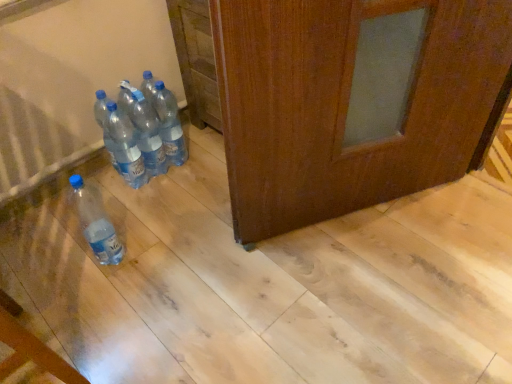
At what (x,y) coordinates should I click in order to perform the action: click on transparent plastic bottles at center, which ranks as the 3th bottle in left-to-right order. Please return your answer as a coordinate pair (x, y). The width and height of the screenshot is (512, 384). Looking at the image, I should click on (145, 130).

You are a GUI agent. You are given a task and a screenshot of the screen. Output one action in this format:
    pyautogui.click(x=<x>, y=<y>)
    Task: Click on the clear plastic bottles at center, the second bottle from the left
    
    Given the screenshot: What is the action you would take?
    pyautogui.click(x=124, y=146)

The height and width of the screenshot is (384, 512). Find the location of `transparent plastic bottles at center, acting as the 4th bottle starting from the left`. transparent plastic bottles at center, acting as the 4th bottle starting from the left is located at coordinates (169, 124).

In terms of size, does transparent plastic bottles at center, the first bottle viewed from the right, appear bigger or smaller than transparent plastic bottles at center, which ranks as the 3th bottle in left-to-right order?

Considering their sizes, transparent plastic bottles at center, the first bottle viewed from the right, takes up more space than transparent plastic bottles at center, which ranks as the 3th bottle in left-to-right order.

From a real-world perspective, is transparent plastic bottles at center, the first bottle viewed from the right, located beneath transparent plastic bottles at center, which ranks as the 3th bottle in left-to-right order?

Yes, from a real-world perspective, transparent plastic bottles at center, the first bottle viewed from the right, is under transparent plastic bottles at center, which ranks as the 3th bottle in left-to-right order.

Can you confirm if transparent plastic bottles at center, the first bottle viewed from the right, is taller than transparent plastic bottles at center, arranged as the 2th bottle when viewed from the right?

No, transparent plastic bottles at center, the first bottle viewed from the right, is not taller than transparent plastic bottles at center, arranged as the 2th bottle when viewed from the right.

Is transparent plastic bottles at center, the first bottle viewed from the right, oriented towards transparent plastic bottles at center, which ranks as the 3th bottle in left-to-right order?

No, transparent plastic bottles at center, the first bottle viewed from the right, is not facing towards transparent plastic bottles at center, which ranks as the 3th bottle in left-to-right order.

Between transparent plastic bottles at center, acting as the 4th bottle starting from the left, and clear plastic bottles at center, which is the 3th bottle in right-to-left order, which one has smaller width?

clear plastic bottles at center, which is the 3th bottle in right-to-left order.

From the image's perspective, relative to clear plastic bottles at center, the second bottle from the left, is transparent plastic bottles at center, the first bottle viewed from the right, above or below?

transparent plastic bottles at center, the first bottle viewed from the right, is situated higher than clear plastic bottles at center, the second bottle from the left, in the image.

Which object is positioned more to the right, transparent plastic bottles at center, acting as the 4th bottle starting from the left, or clear plastic bottles at center, the second bottle from the left?

transparent plastic bottles at center, acting as the 4th bottle starting from the left, is more to the right.

Is transparent plastic bottles at center, which ranks as the 3th bottle in left-to-right order, wider or thinner than matte plastic bottle at lower left, marked as the 1th bottle in a left-to-right arrangement?

In the image, transparent plastic bottles at center, which ranks as the 3th bottle in left-to-right order, appears to be more narrow than matte plastic bottle at lower left, marked as the 1th bottle in a left-to-right arrangement.

What's the angular difference between transparent plastic bottles at center, arranged as the 2th bottle when viewed from the right, and matte plastic bottle at lower left, which appears as the fourth bottle when viewed from the right,'s facing directions?

The angular difference between transparent plastic bottles at center, arranged as the 2th bottle when viewed from the right, and matte plastic bottle at lower left, which appears as the fourth bottle when viewed from the right, is 0.00195 degrees.

Considering the positions of point (145, 134) and point (79, 187), is point (145, 134) closer or farther from the camera than point (79, 187)?

Point (145, 134) is positioned farther from the camera compared to point (79, 187).

Can you confirm if matte plastic bottle at lower left, marked as the 1th bottle in a left-to-right arrangement, is taller than clear plastic bottles at center, which is the 3th bottle in right-to-left order?

Incorrect, the height of matte plastic bottle at lower left, marked as the 1th bottle in a left-to-right arrangement, is not larger of that of clear plastic bottles at center, which is the 3th bottle in right-to-left order.

From the image's perspective, which is below, matte plastic bottle at lower left, marked as the 1th bottle in a left-to-right arrangement, or clear plastic bottles at center, the second bottle from the left?

From the image's view, matte plastic bottle at lower left, marked as the 1th bottle in a left-to-right arrangement, is below.

What's the angular difference between matte plastic bottle at lower left, which appears as the fourth bottle when viewed from the right, and clear plastic bottles at center, which is the 3th bottle in right-to-left order,'s facing directions?

matte plastic bottle at lower left, which appears as the fourth bottle when viewed from the right, and clear plastic bottles at center, which is the 3th bottle in right-to-left order, are facing 0.000405 degrees away from each other.

Is matte plastic bottle at lower left, marked as the 1th bottle in a left-to-right arrangement, completely or partially outside of clear plastic bottles at center, which is the 3th bottle in right-to-left order?

That's correct, matte plastic bottle at lower left, marked as the 1th bottle in a left-to-right arrangement, is outside of clear plastic bottles at center, which is the 3th bottle in right-to-left order.

Consider the image. Can you tell me how much transparent plastic bottles at center, which ranks as the 3th bottle in left-to-right order, and transparent plastic bottles at center, acting as the 4th bottle starting from the left, differ in facing direction?

The facing directions of transparent plastic bottles at center, which ranks as the 3th bottle in left-to-right order, and transparent plastic bottles at center, acting as the 4th bottle starting from the left, are 0.00369 degrees apart.

Which is more to the right, transparent plastic bottles at center, which ranks as the 3th bottle in left-to-right order, or transparent plastic bottles at center, the first bottle viewed from the right?

transparent plastic bottles at center, the first bottle viewed from the right, is more to the right.

Measure the distance from transparent plastic bottles at center, which ranks as the 3th bottle in left-to-right order, to transparent plastic bottles at center, acting as the 4th bottle starting from the left.

transparent plastic bottles at center, which ranks as the 3th bottle in left-to-right order, is 2.06 inches from transparent plastic bottles at center, acting as the 4th bottle starting from the left.

Considering the positions of point (154, 110) and point (177, 120), is point (154, 110) closer or farther from the camera than point (177, 120)?

Point (154, 110) appears to be closer to the viewer than point (177, 120).

Is transparent plastic bottles at center, acting as the 4th bottle starting from the left, situated inside matte plastic bottle at lower left, which appears as the fourth bottle when viewed from the right, or outside?

transparent plastic bottles at center, acting as the 4th bottle starting from the left, is not inside matte plastic bottle at lower left, which appears as the fourth bottle when viewed from the right, it's outside.

Is transparent plastic bottles at center, the first bottle viewed from the right, thinner than matte plastic bottle at lower left, marked as the 1th bottle in a left-to-right arrangement?

In fact, transparent plastic bottles at center, the first bottle viewed from the right, might be wider than matte plastic bottle at lower left, marked as the 1th bottle in a left-to-right arrangement.

Which is more to the left, transparent plastic bottles at center, the first bottle viewed from the right, or matte plastic bottle at lower left, marked as the 1th bottle in a left-to-right arrangement?

Positioned to the left is matte plastic bottle at lower left, marked as the 1th bottle in a left-to-right arrangement.

Measure the distance from matte plastic bottle at lower left, marked as the 1th bottle in a left-to-right arrangement, to transparent plastic bottles at center, acting as the 4th bottle starting from the left.

matte plastic bottle at lower left, marked as the 1th bottle in a left-to-right arrangement, is 16.47 inches from transparent plastic bottles at center, acting as the 4th bottle starting from the left.

Is point (85, 188) positioned behind point (162, 87)?

That is True.

Is matte plastic bottle at lower left, marked as the 1th bottle in a left-to-right arrangement, aimed at transparent plastic bottles at center, the first bottle viewed from the right?

No.

Between matte plastic bottle at lower left, marked as the 1th bottle in a left-to-right arrangement, and transparent plastic bottles at center, the first bottle viewed from the right, which one has more height?

transparent plastic bottles at center, the first bottle viewed from the right.

From a real-world perspective, which bottle is the 1st one underneath the transparent plastic bottles at center, arranged as the 2th bottle when viewed from the right? Please provide its 2D coordinates.

[(169, 124)]

What are the coordinates of `bottle that is the 2nd one when counting forward from the transparent plastic bottles at center, the first bottle viewed from the right` in the screenshot? It's located at 124,146.

Looking at the image, which one is located closer to clear plastic bottles at center, the second bottle from the left, transparent plastic bottles at center, arranged as the 2th bottle when viewed from the right, or matte plastic bottle at lower left, which appears as the fourth bottle when viewed from the right?

transparent plastic bottles at center, arranged as the 2th bottle when viewed from the right, is closer to clear plastic bottles at center, the second bottle from the left.

When comparing their distances from matte plastic bottle at lower left, which appears as the fourth bottle when viewed from the right, does transparent plastic bottles at center, the first bottle viewed from the right, or transparent plastic bottles at center, which ranks as the 3th bottle in left-to-right order, seem closer?

transparent plastic bottles at center, which ranks as the 3th bottle in left-to-right order.

From the image, which object appears to be farther from transparent plastic bottles at center, the first bottle viewed from the right, transparent plastic bottles at center, arranged as the 2th bottle when viewed from the right, or clear plastic bottles at center, the second bottle from the left?

The object further to transparent plastic bottles at center, the first bottle viewed from the right, is clear plastic bottles at center, the second bottle from the left.

From the image, which object appears to be farther from transparent plastic bottles at center, acting as the 4th bottle starting from the left, transparent plastic bottles at center, which ranks as the 3th bottle in left-to-right order, or matte plastic bottle at lower left, which appears as the fourth bottle when viewed from the right?

matte plastic bottle at lower left, which appears as the fourth bottle when viewed from the right, is further to transparent plastic bottles at center, acting as the 4th bottle starting from the left.

Considering their positions, is transparent plastic bottles at center, arranged as the 2th bottle when viewed from the right, positioned closer to matte plastic bottle at lower left, marked as the 1th bottle in a left-to-right arrangement, than transparent plastic bottles at center, acting as the 4th bottle starting from the left?

transparent plastic bottles at center, arranged as the 2th bottle when viewed from the right, lies closer to matte plastic bottle at lower left, marked as the 1th bottle in a left-to-right arrangement, than the other object.

Based on their spatial positions, is matte plastic bottle at lower left, which appears as the fourth bottle when viewed from the right, or transparent plastic bottles at center, which ranks as the 3th bottle in left-to-right order, closer to transparent plastic bottles at center, the first bottle viewed from the right?

transparent plastic bottles at center, which ranks as the 3th bottle in left-to-right order, is positioned closer to the anchor transparent plastic bottles at center, the first bottle viewed from the right.

From the image, which object appears to be farther from clear plastic bottles at center, the second bottle from the left, transparent plastic bottles at center, arranged as the 2th bottle when viewed from the right, or transparent plastic bottles at center, the first bottle viewed from the right?

Among the two, transparent plastic bottles at center, the first bottle viewed from the right, is located further to clear plastic bottles at center, the second bottle from the left.

From the image, which object appears to be farther from transparent plastic bottles at center, which ranks as the 3th bottle in left-to-right order, matte plastic bottle at lower left, which appears as the fourth bottle when viewed from the right, or transparent plastic bottles at center, the first bottle viewed from the right?

Among the two, matte plastic bottle at lower left, which appears as the fourth bottle when viewed from the right, is located further to transparent plastic bottles at center, which ranks as the 3th bottle in left-to-right order.

I want to click on bottle between transparent plastic bottles at center, which ranks as the 3th bottle in left-to-right order, and matte plastic bottle at lower left, marked as the 1th bottle in a left-to-right arrangement, in the up-down direction, so click(124, 146).

The width and height of the screenshot is (512, 384). I want to click on bottle between clear plastic bottles at center, the second bottle from the left, and transparent plastic bottles at center, the first bottle viewed from the right, in the horizontal direction, so click(145, 130).